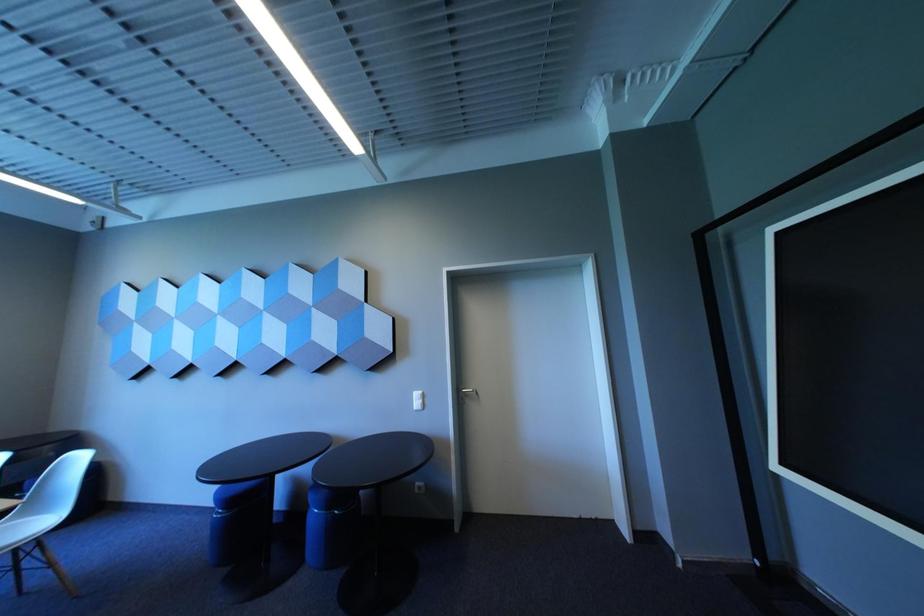
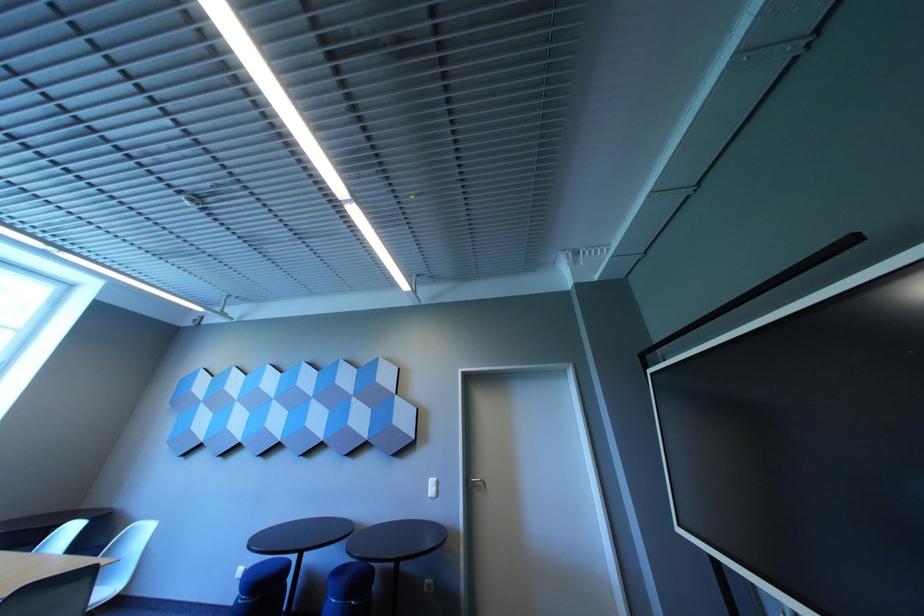
Question: How did the camera likely rotate?

Choices:
 (A) Left
 (B) Right
 (C) Up
 (D) Down

Answer: (C)